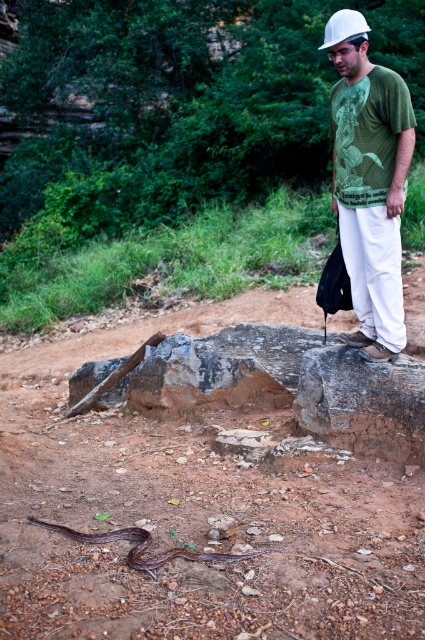
Is brown dirt track at lower center smaller than white hard hat at upper center?

Indeed, brown dirt track at lower center has a smaller size compared to white hard hat at upper center.

Can you confirm if brown dirt track at lower center is positioned to the right of white hard hat at upper center?

In fact, brown dirt track at lower center is to the left of white hard hat at upper center.

In the scene shown: Who is more forward, [289,595] or [353,29]?

Point [289,595] is more forward.

Locate an element on the screen. The width and height of the screenshot is (425, 640). brown dirt track at lower center is located at coordinates (193, 513).

Can you confirm if green matte t-shirt at center is positioned below white hard hat at upper center?

Correct, green matte t-shirt at center is located below white hard hat at upper center.

Consider the image. Between green matte t-shirt at center and white hard hat at upper center, which one has less height?

With less height is green matte t-shirt at center.

Describe the element at coordinates (368, 180) in the screenshot. I see `green matte t-shirt at center` at that location.

Where is `green matte t-shirt at center`? green matte t-shirt at center is located at coordinates (368, 180).

Between brown dirt track at lower center and green matte t-shirt at center, which one is positioned lower?

brown dirt track at lower center

Locate an element on the screen. brown dirt track at lower center is located at coordinates (193, 513).

You are a GUI agent. You are given a task and a screenshot of the screen. Output one action in this format:
    pyautogui.click(x=<x>, y=<y>)
    Task: Click on the brown dirt track at lower center
    The image size is (425, 640).
    Given the screenshot: What is the action you would take?
    pyautogui.click(x=193, y=513)